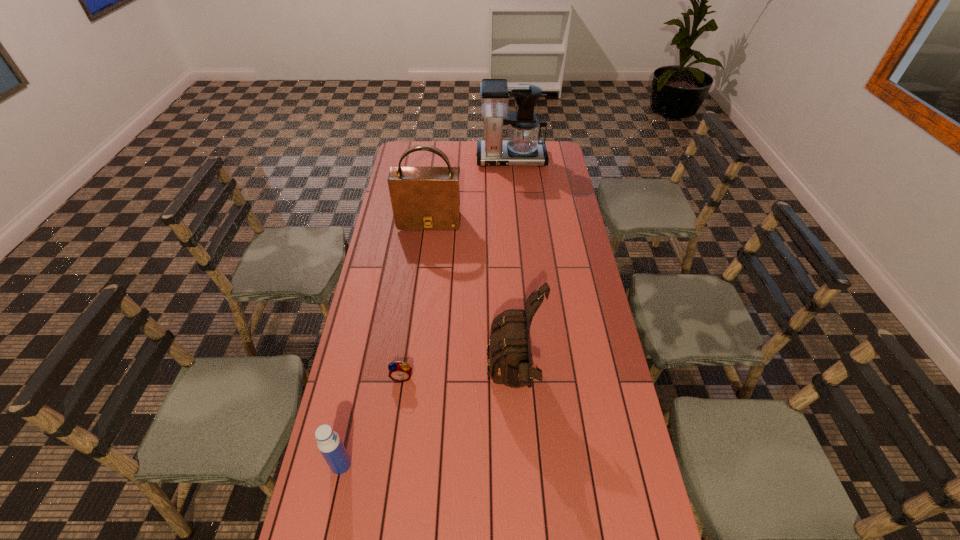
Find the location of a particular element. The image size is (960, 540). vacant space at the far edge is located at coordinates (454, 152).

This screenshot has width=960, height=540. Identify the location of vacant region at the left edge of the desktop. (372, 363).

Where is `vacant region at the right edge of the desktop`? Image resolution: width=960 pixels, height=540 pixels. vacant region at the right edge of the desktop is located at coordinates (567, 242).

Where is `free spot between the water bottle and the alarm clock`? Image resolution: width=960 pixels, height=540 pixels. free spot between the water bottle and the alarm clock is located at coordinates (372, 421).

Where is `free space between the farthest object and the alarm clock`? free space between the farthest object and the alarm clock is located at coordinates (457, 268).

This screenshot has width=960, height=540. What are the coordinates of `free space between the right shoulder bag and the second shortest object` in the screenshot? It's located at (428, 423).

The image size is (960, 540). In order to click on free space between the right shoulder bag and the second shortest object in this screenshot , I will do pos(428,423).

The height and width of the screenshot is (540, 960). What are the coordinates of `free spot between the coffee maker and the alarm clock` in the screenshot? It's located at (457, 268).

Where is `vacant area between the shortest object and the farthest object`? vacant area between the shortest object and the farthest object is located at coordinates (457, 268).

Where is `vacant area that lies between the nearest object and the right shoulder bag`? This screenshot has width=960, height=540. vacant area that lies between the nearest object and the right shoulder bag is located at coordinates (428, 423).